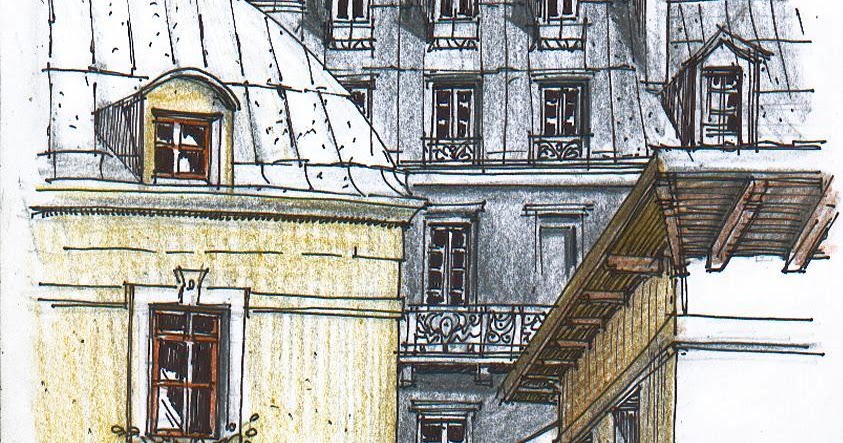
Image resolution: width=843 pixels, height=443 pixels. I want to click on white roof, so click(72, 48).